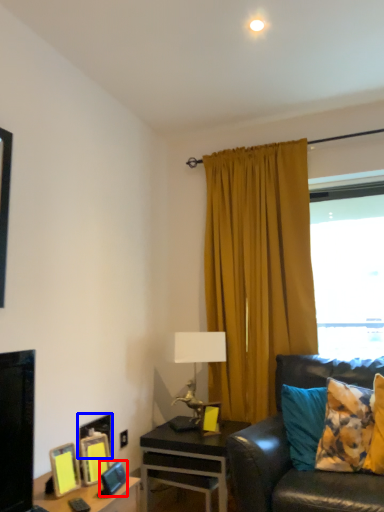
Question: Which point is further to the camera, picture frame (highlighted by a red box) or picture frame (highlighted by a blue box)?

Choices:
 (A) picture frame
 (B) picture frame

Answer: (B)